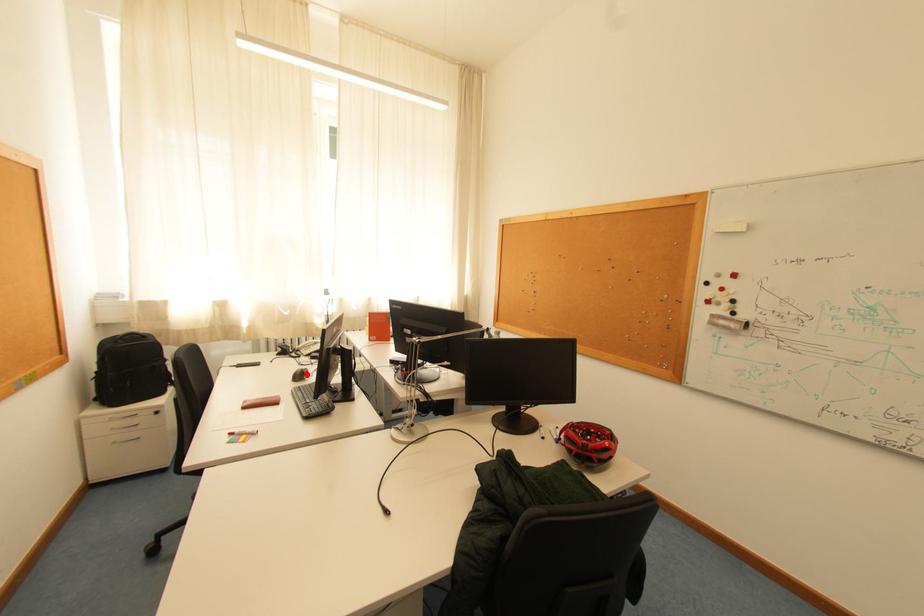
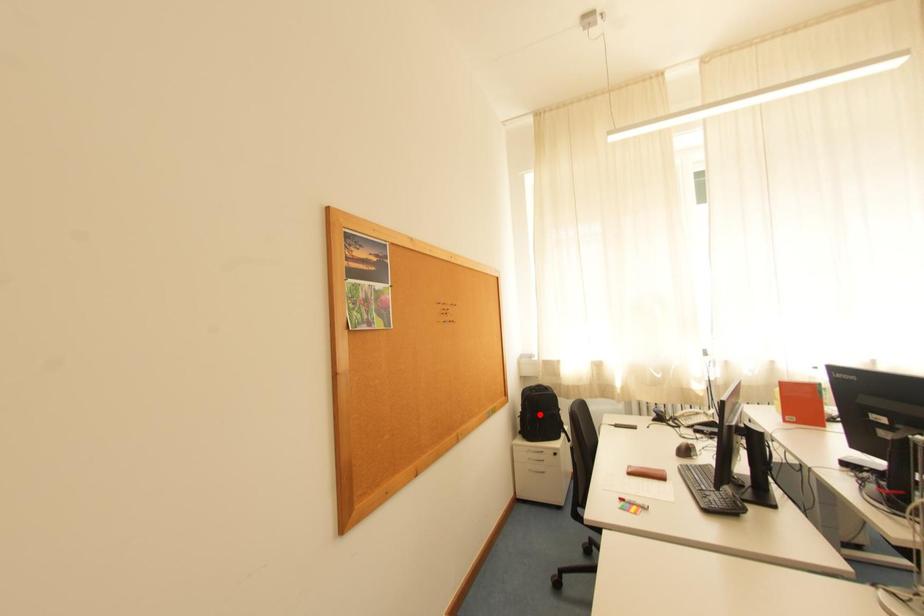
I am providing you with two images of the same scene from different viewpoints. A red point is marked on the first image and another point is marked on the second image. Do the highlighted points in image1 and image2 indicate the same real-world spot?

No